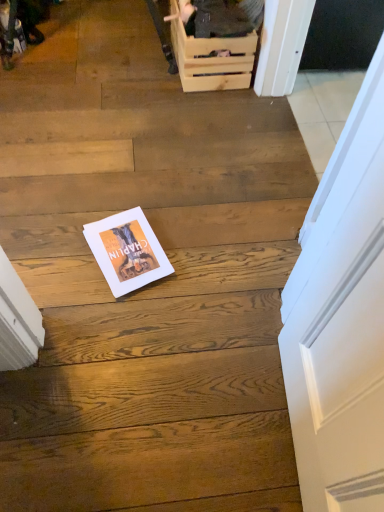
Identify the location of blank space to the left of white paper magazine at center. (52, 249).